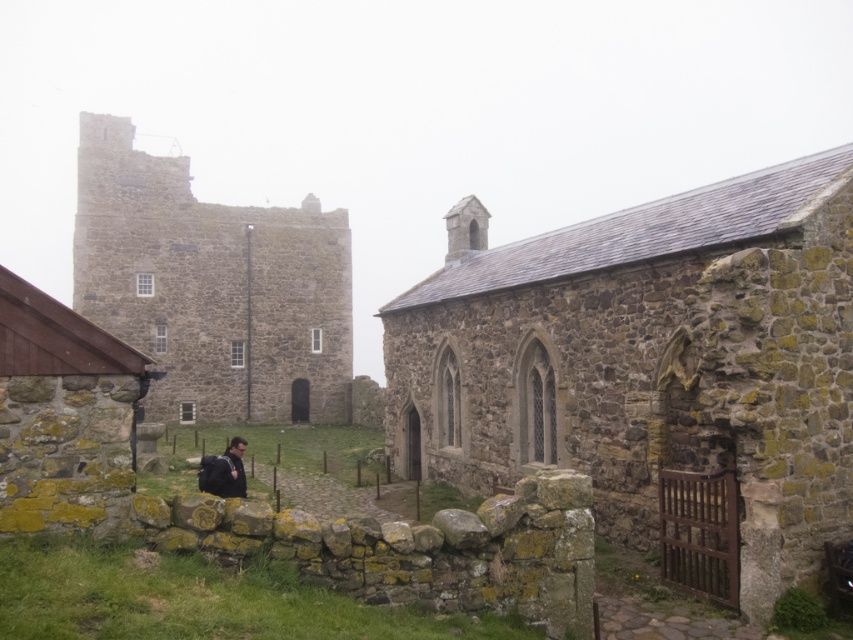
Can you confirm if rustic stone church at center is bigger than dark blue backpack at lower center?

Yes, rustic stone church at center is bigger than dark blue backpack at lower center.

Is point (450, 454) positioned after point (239, 467)?

Yes, it is behind point (239, 467).

You are a GUI agent. You are given a task and a screenshot of the screen. Output one action in this format:
    pyautogui.click(x=<x>, y=<y>)
    Task: Click on the rustic stone church at center
    The image size is (853, 640).
    Given the screenshot: What is the action you would take?
    pyautogui.click(x=648, y=358)

Can you confirm if rustic stone church at center is thinner than gray stone tower at center-left?

Yes.

This screenshot has height=640, width=853. Find the location of `rustic stone church at center`. rustic stone church at center is located at coordinates (648, 358).

This screenshot has height=640, width=853. Identify the location of rustic stone church at center. (648, 358).

Which of these two, gray stone tower at center-left or dark blue backpack at lower center, stands taller?

Standing taller between the two is gray stone tower at center-left.

Between gray stone tower at center-left and dark blue backpack at lower center, which one appears on the left side from the viewer's perspective?

From the viewer's perspective, gray stone tower at center-left appears more on the left side.

Find the location of a particular element. The image size is (853, 640). gray stone tower at center-left is located at coordinates (212, 288).